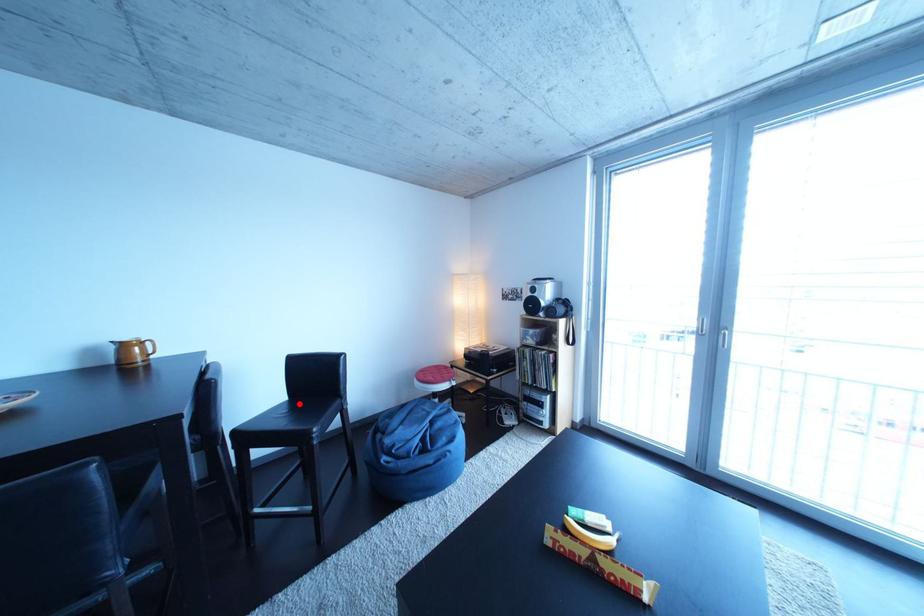
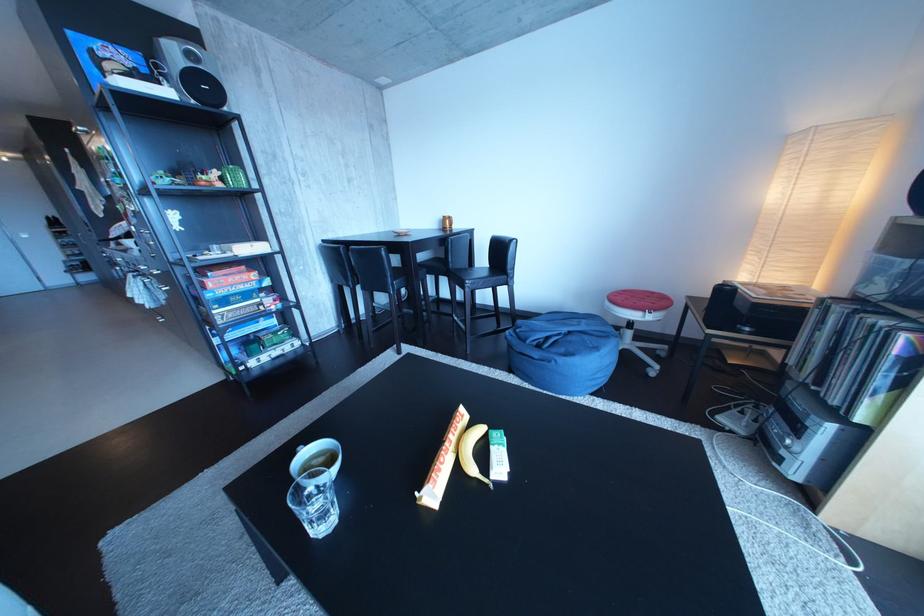
Where in the second image is the point corresponding to the highlighted location from the first image?

(501, 272)